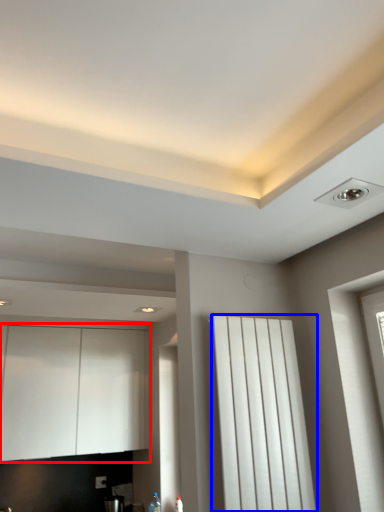
Question: Which object is closer to the camera taking this photo, cabinetry (highlighted by a red box) or curtain (highlighted by a blue box)?

Choices:
 (A) cabinetry
 (B) curtain

Answer: (B)